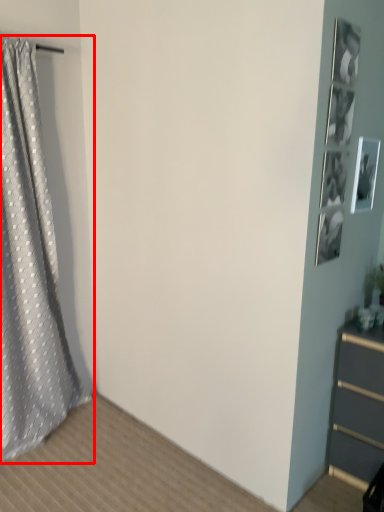
Question: From the image's perspective, what is the correct spatial positioning of curtain (annotated by the red box) in reference to picture frame?

Choices:
 (A) above
 (B) below

Answer: (B)